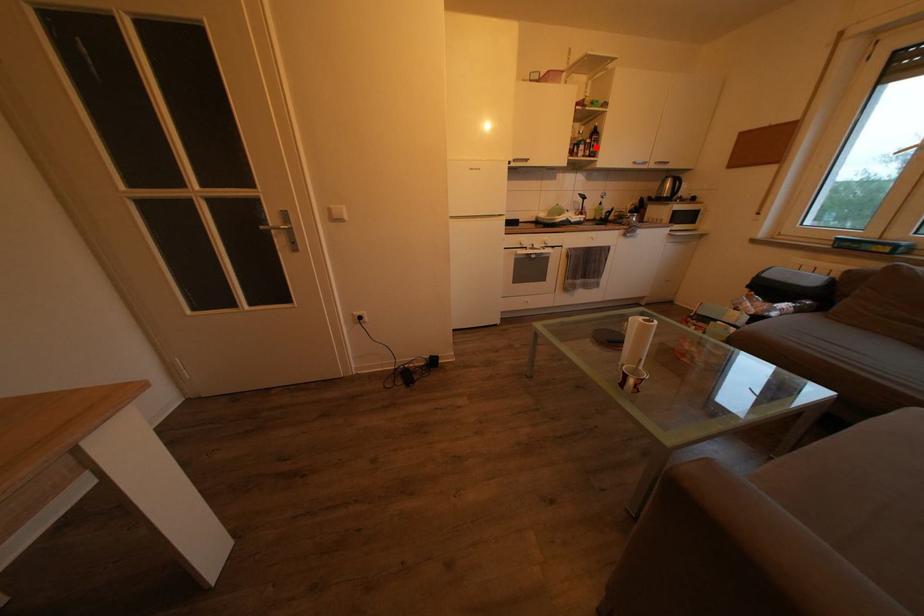
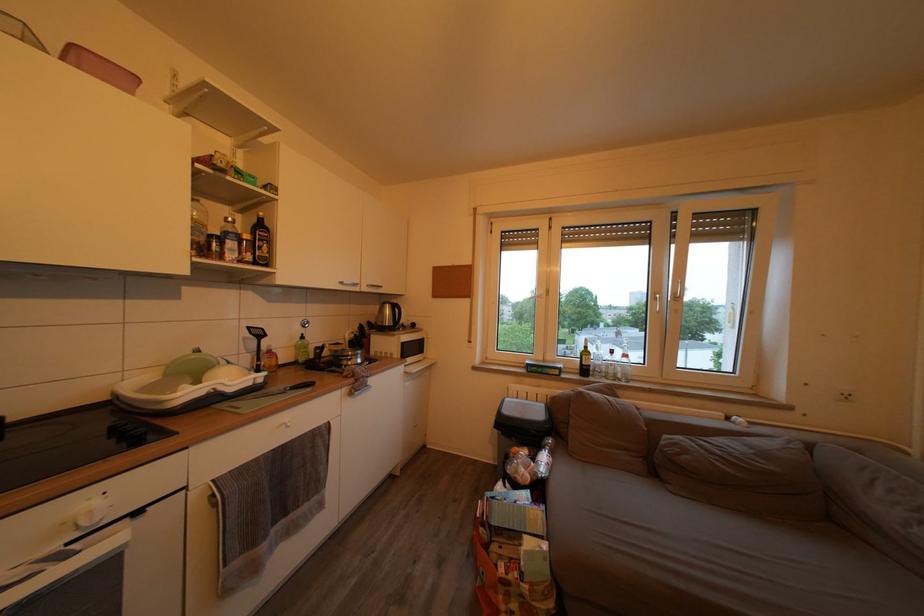
Question: I am providing you with two images of the same scene from different viewpoints. A red point is marked on the first image. Is the red point's position out of view in image 2?

Choices:
 (A) Yes
 (B) No

Answer: (B)